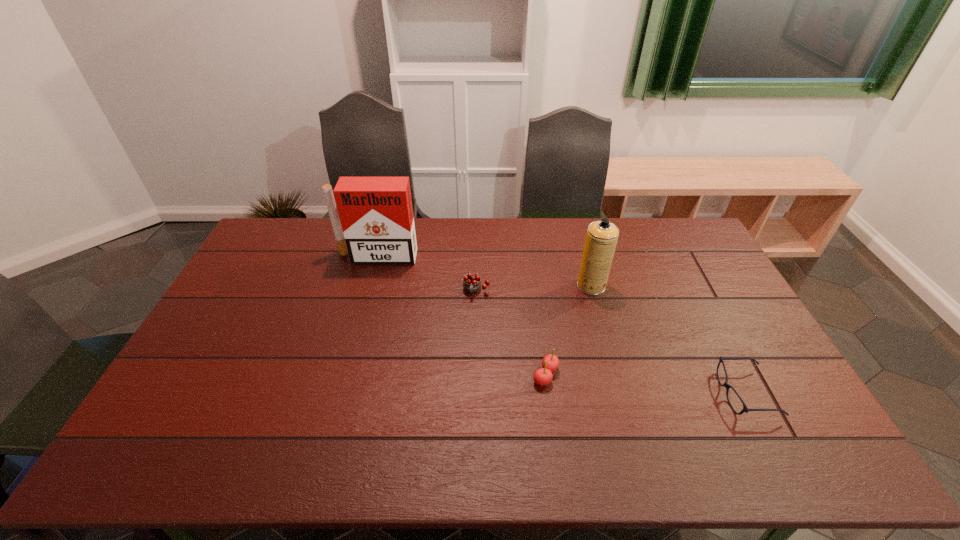
The image size is (960, 540). Find the location of `free space between the farthest object and the fourth object from left to right`. free space between the farthest object and the fourth object from left to right is located at coordinates click(484, 271).

Locate an element on the screen. The image size is (960, 540). vacant region between the right cherry and the leftmost object is located at coordinates (461, 316).

Identify the location of free space between the nearer cherry and the farther cherry. (511, 333).

At what (x,y) coordinates should I click in order to perform the action: click on object that is the third nearest to the spectacles. Please return your answer as a coordinate pair (x, y). This screenshot has height=540, width=960. Looking at the image, I should click on (472, 282).

This screenshot has height=540, width=960. I want to click on object that is the fourth closest to the aerosol can, so click(x=376, y=213).

The width and height of the screenshot is (960, 540). Find the location of `vacant area that satisfies the following two spatial constraints: 1. on the front-facing side of the leftmost object; 2. on the left side of the fourth object from left to right`. vacant area that satisfies the following two spatial constraints: 1. on the front-facing side of the leftmost object; 2. on the left side of the fourth object from left to right is located at coordinates (370, 286).

This screenshot has width=960, height=540. Identify the location of free location that satisfies the following two spatial constraints: 1. on the front-facing side of the aerosol can; 2. on the right side of the farthest object. (370, 286).

Where is `free point that satisfies the following two spatial constraints: 1. on the handle side of the left cherry; 2. on the left side of the third object from left to right`? Image resolution: width=960 pixels, height=540 pixels. free point that satisfies the following two spatial constraints: 1. on the handle side of the left cherry; 2. on the left side of the third object from left to right is located at coordinates (476, 375).